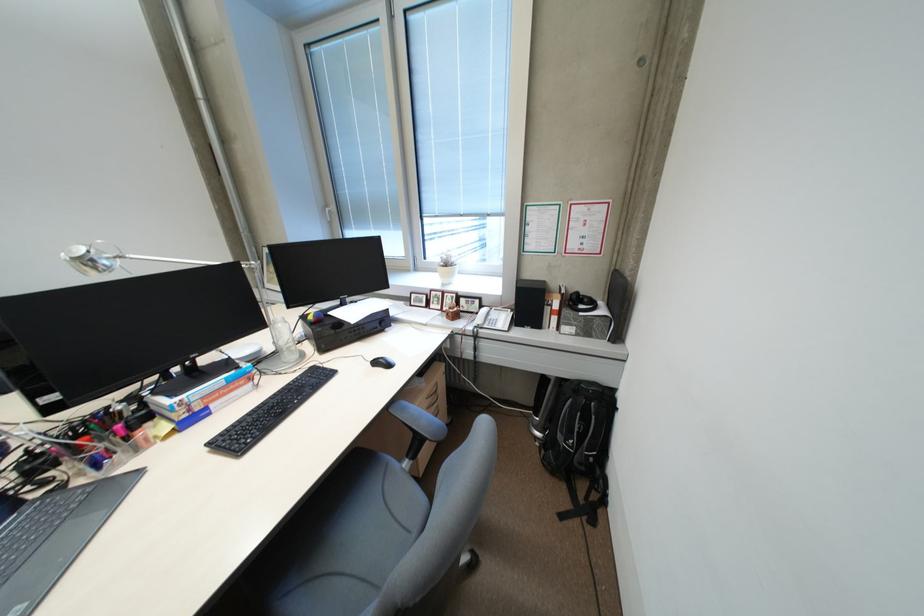
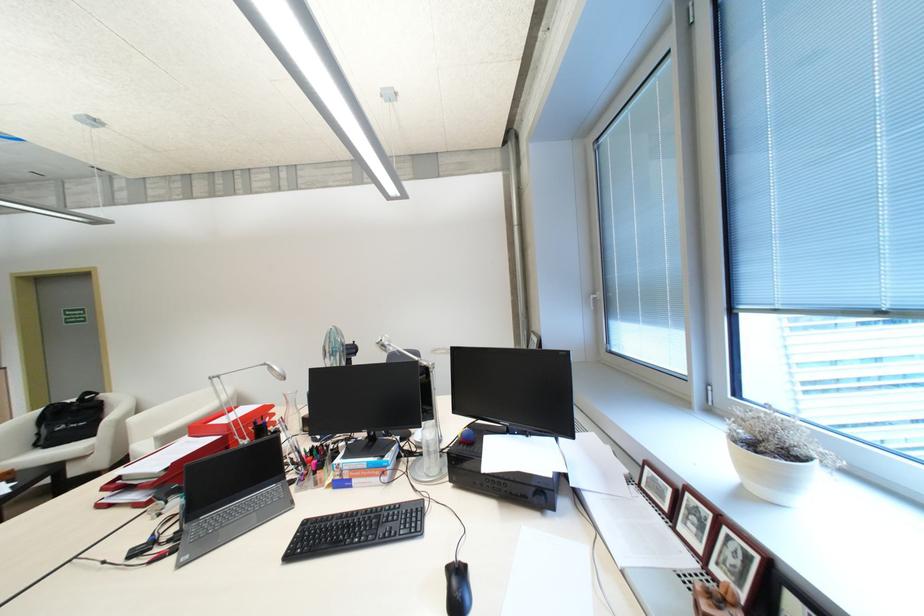
Locate, in the second image, the point that corresponds to point 306,355 in the first image.

(444, 469)